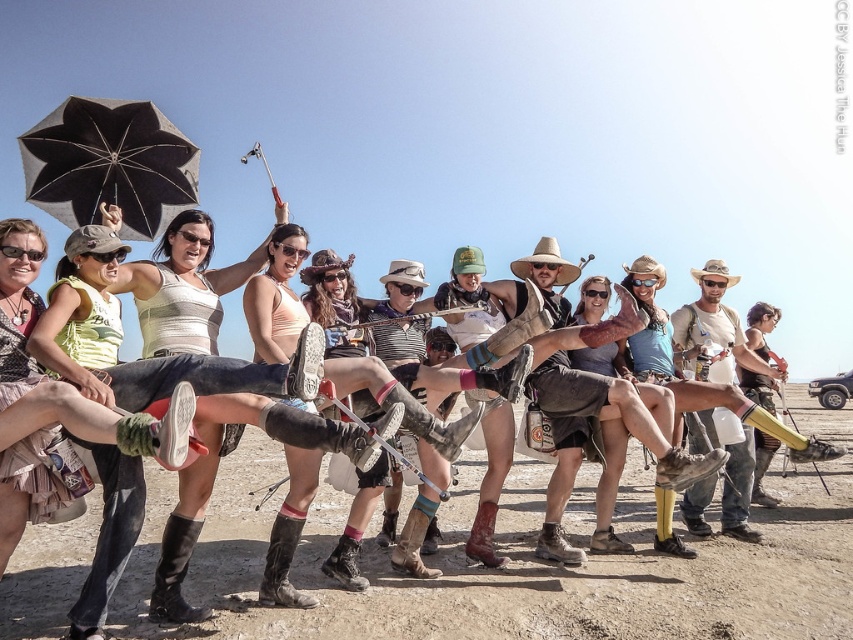
Question: Is black matte umbrella at upper left thinner than leather/cowhide cowboy boot at lower center?

Choices:
 (A) no
 (B) yes

Answer: (A)

Question: Is matte black cowboy hat at right bigger than brown leather boot at center?

Choices:
 (A) no
 (B) yes

Answer: (A)

Question: Which of the following is the closest to the observer?

Choices:
 (A) black matte umbrella at upper left
 (B) brown leather boot at center
 (C) matte black cowboy hat at right
 (D) dusty brown dirt at center

Answer: (D)

Question: Is matte black cowboy hat at right below leather/cowhide cowboy boot at lower center?

Choices:
 (A) yes
 (B) no

Answer: (B)

Question: Among these points, which one is farthest from the camera?

Choices:
 (A) (165, 589)
 (B) (173, 198)
 (C) (747, 337)
 (D) (485, 563)

Answer: (C)

Question: Which point is closer to the camera?

Choices:
 (A) black matte umbrella at upper left
 (B) matte black boots at center
 (C) black leather cowboy boot at lower left

Answer: (B)